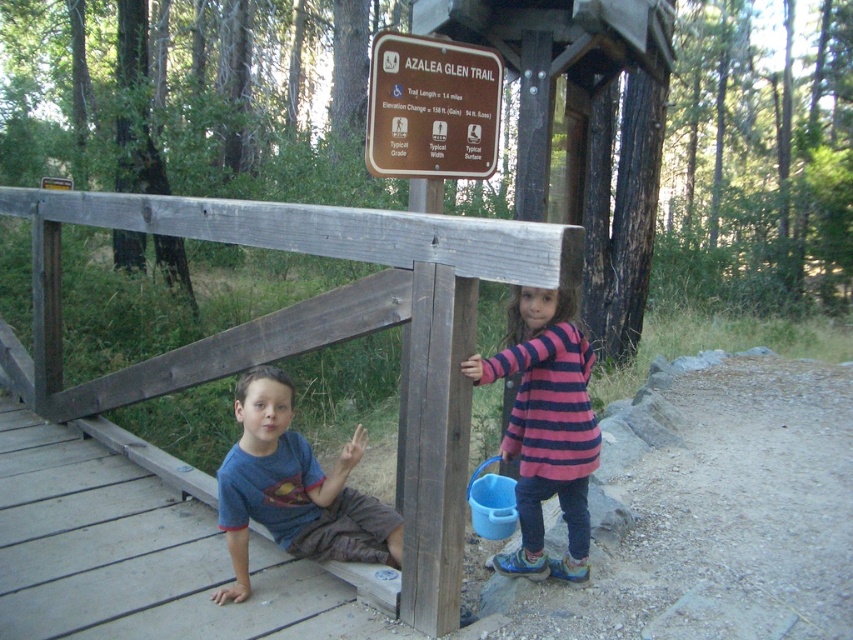
Question: Which point is farther from the camera taking this photo?

Choices:
 (A) (473, 124)
 (B) (346, 470)

Answer: (A)

Question: Estimate the real-world distances between objects in this image. Which object is farther from the blue cotton shirt at lower left?

Choices:
 (A) brown wooden sign at upper center
 (B) pink striped sweater at center

Answer: (A)

Question: Does pink striped sweater at center have a greater width compared to blue cotton shirt at lower left?

Choices:
 (A) yes
 (B) no

Answer: (B)

Question: Does pink striped sweater at center appear under brown wooden sign at upper center?

Choices:
 (A) no
 (B) yes

Answer: (B)

Question: Which point is farther to the camera?

Choices:
 (A) pink striped sweater at center
 (B) blue cotton shirt at lower left
 (C) brown wooden sign at upper center

Answer: (C)

Question: Is blue cotton shirt at lower left further to camera compared to brown wooden sign at upper center?

Choices:
 (A) no
 (B) yes

Answer: (A)